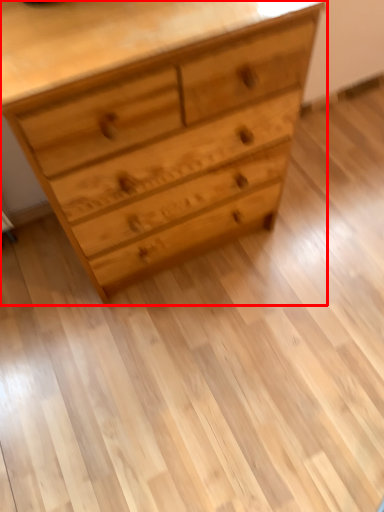
Question: From the image's perspective, where is chest of drawers (annotated by the red box) located relative to drawer?

Choices:
 (A) above
 (B) below

Answer: (B)